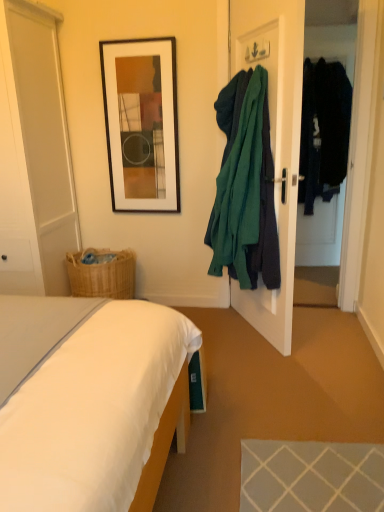
This screenshot has height=512, width=384. I want to click on vacant area situated below teal fabric coat at right, positioned as the first clothing in front-to-back order (from a real-world perspective), so click(x=228, y=344).